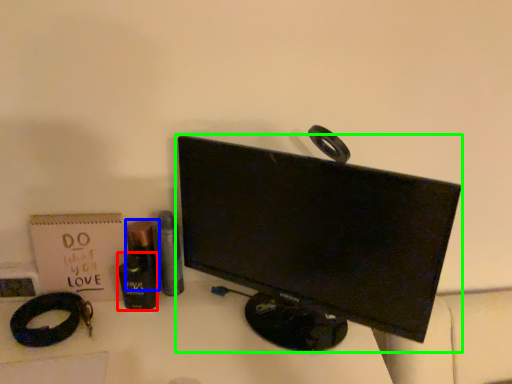
Question: Which object is positioned closest to toiletry (highlighted by a red box)? Select from toiletry (highlighted by a blue box) and computer monitor (highlighted by a green box).

Choices:
 (A) toiletry
 (B) computer monitor

Answer: (A)